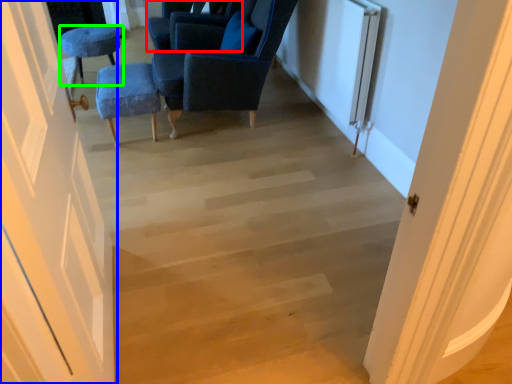
Question: Which is farther away from chair (highlighted by a red box)? door (highlighted by a blue box) or furniture (highlighted by a green box)?

Choices:
 (A) door
 (B) furniture

Answer: (A)